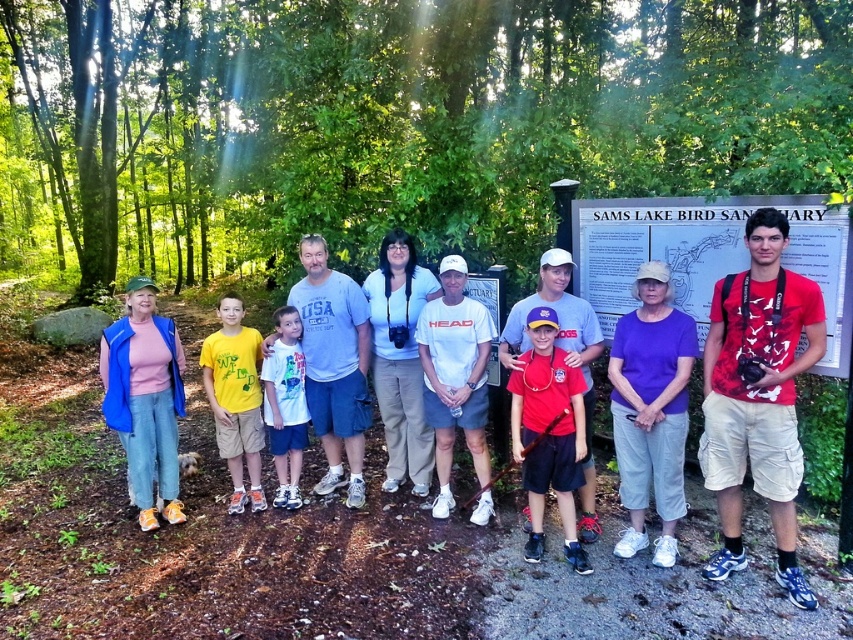
You are standing at the point marked as point (86, 291) in the forest scene. If you want to take a photo of the group using a camera that has a maximum focus distance of 15 meters, will you be able to capture them clearly?

The point (86, 291) is 13.96 meters away from the camera. Since 13.96 meters is within the camera maximum focus distance of 15 meters, you can capture the group clearly.